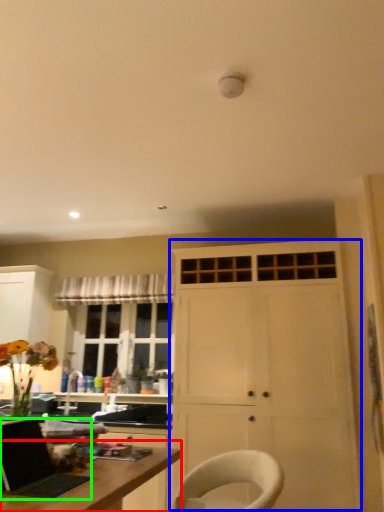
Question: Estimate the real-world distances between objects in this image. Which object is farther from desk (highlighted by a red box), cabinetry (highlighted by a blue box) or laptop (highlighted by a green box)?

Choices:
 (A) cabinetry
 (B) laptop

Answer: (A)